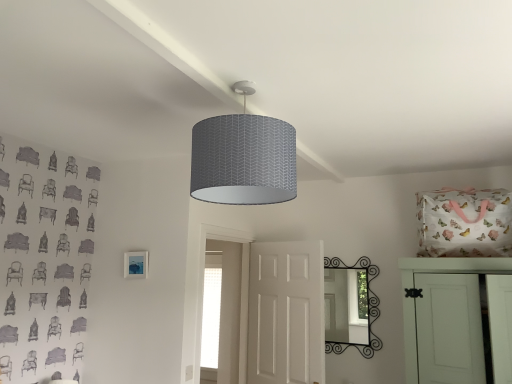
Question: Can you confirm if matte blue picture frame at lower left is smaller than black wrought iron mirror at center?

Choices:
 (A) no
 (B) yes

Answer: (B)

Question: Is matte blue picture frame at lower left closer to camera compared to black wrought iron mirror at center?

Choices:
 (A) no
 (B) yes

Answer: (B)

Question: Can you confirm if matte blue picture frame at lower left is bigger than black wrought iron mirror at center?

Choices:
 (A) yes
 (B) no

Answer: (B)

Question: Considering the relative sizes of matte blue picture frame at lower left and black wrought iron mirror at center in the image provided, is matte blue picture frame at lower left taller than black wrought iron mirror at center?

Choices:
 (A) no
 (B) yes

Answer: (A)

Question: Is matte blue picture frame at lower left shorter than black wrought iron mirror at center?

Choices:
 (A) yes
 (B) no

Answer: (A)

Question: Looking at the image, does matte blue picture frame at lower left seem bigger or smaller compared to white matte door at center, the first door when ordered from left to right?

Choices:
 (A) big
 (B) small

Answer: (B)

Question: Does point (129, 266) appear closer or farther from the camera than point (280, 258)?

Choices:
 (A) closer
 (B) farther

Answer: (A)

Question: From a real-world perspective, is matte blue picture frame at lower left physically located above or below white matte door at center, the first door when ordered from left to right?

Choices:
 (A) above
 (B) below

Answer: (A)

Question: Which is correct: matte blue picture frame at lower left is inside white matte door at center, the first door when ordered from left to right, or outside of it?

Choices:
 (A) outside
 (B) inside

Answer: (A)

Question: From their relative heights in the image, would you say black wrought iron mirror at center is taller or shorter than white matte cabinet door at right, placed as the second door when sorted from left to right?

Choices:
 (A) short
 (B) tall

Answer: (A)

Question: From the image's perspective, is black wrought iron mirror at center positioned above or below white matte cabinet door at right, placed as the second door when sorted from left to right?

Choices:
 (A) below
 (B) above

Answer: (A)

Question: Looking at the image, does black wrought iron mirror at center seem bigger or smaller compared to white matte cabinet door at right, the 1th door viewed from the right?

Choices:
 (A) big
 (B) small

Answer: (B)

Question: Looking at their shapes, would you say black wrought iron mirror at center is wider or thinner than white matte cabinet door at right, the 1th door viewed from the right?

Choices:
 (A) thin
 (B) wide

Answer: (A)

Question: From the image's perspective, is white matte door at center, which ranks as the second door in right-to-left order, above or below black wrought iron mirror at center?

Choices:
 (A) above
 (B) below

Answer: (B)

Question: In the image, is white matte door at center, the first door when ordered from left to right, on the left side or the right side of black wrought iron mirror at center?

Choices:
 (A) right
 (B) left

Answer: (B)